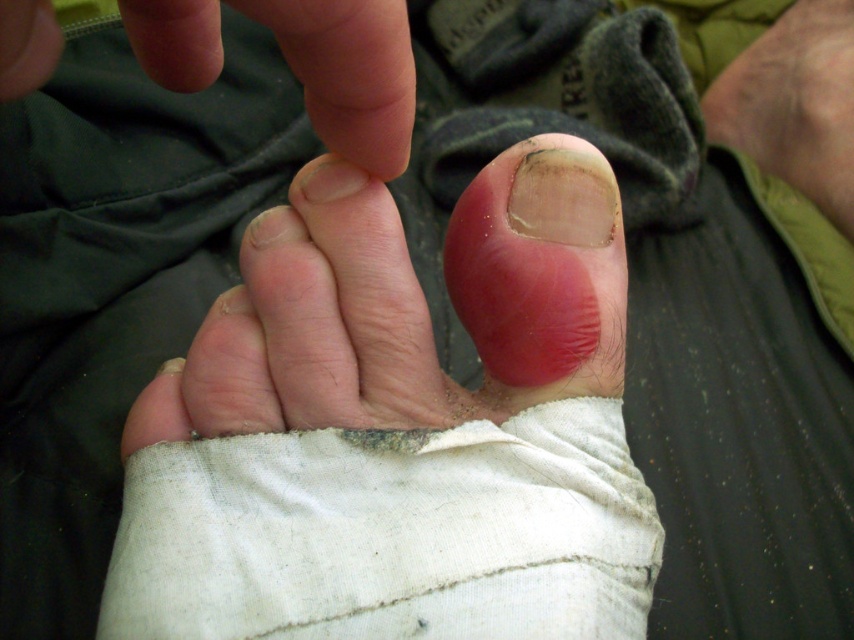
Question: Is pink flesh-toned nail at center thinner than dry skin at upper right?

Choices:
 (A) no
 (B) yes

Answer: (B)

Question: Does pink flesh-toned nail at center have a greater width compared to dry skin at upper right?

Choices:
 (A) yes
 (B) no

Answer: (B)

Question: Which point is farther to the camera?

Choices:
 (A) pink flesh-toned toe at center
 (B) dry skin at upper right

Answer: (B)

Question: Which point is closer to the camera?

Choices:
 (A) pink flesh-toned nail at center
 (B) pink flesh-toned toe at center

Answer: (A)

Question: In this image, where is pink flesh-toned toe at center located relative to pink flesh-toned nail at center?

Choices:
 (A) right
 (B) left

Answer: (B)

Question: Which object is the farthest from the pink flesh-toned toe at center?

Choices:
 (A) dry skin at upper right
 (B) pink flesh-toned nail at center

Answer: (A)